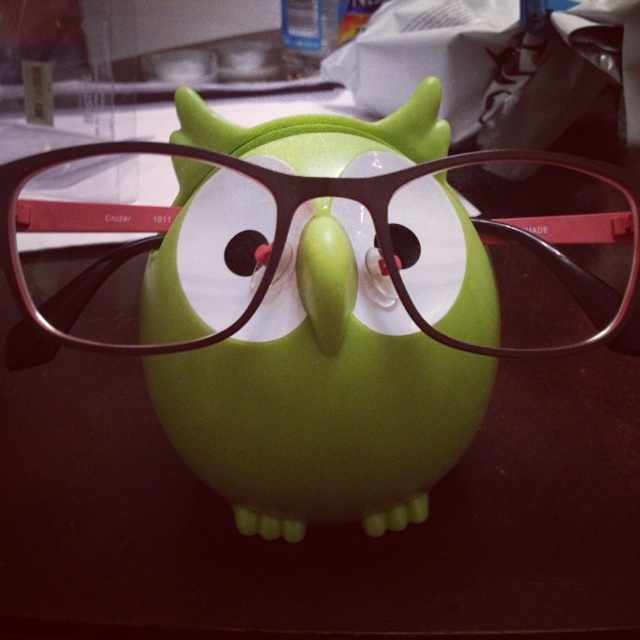
Looking at this image, is matte black glasses at center positioned at the back of matte black eye at center?

No, matte black glasses at center is in front of matte black eye at center.

From the picture: Can you confirm if matte black glasses at center is smaller than matte black eye at center?

No, matte black glasses at center is not smaller than matte black eye at center.

Is point (138, 241) farther from viewer compared to point (232, 269)?

Yes, it is.

You are a GUI agent. You are given a task and a screenshot of the screen. Output one action in this format:
    pyautogui.click(x=<x>, y=<y>)
    Task: Click on the matte black glasses at center
    The height and width of the screenshot is (640, 640).
    Given the screenshot: What is the action you would take?
    coord(288,244)

Can you confirm if green matte/soft toy at center is wider than matte black glasses at center?

In fact, green matte/soft toy at center might be narrower than matte black glasses at center.

Which is more to the left, green matte/soft toy at center or matte black glasses at center?

From the viewer's perspective, green matte/soft toy at center appears more on the left side.

The image size is (640, 640). What do you see at coordinates (323, 394) in the screenshot? I see `green matte/soft toy at center` at bounding box center [323, 394].

I want to click on green matte/soft toy at center, so click(323, 394).

Consider the image. Between green matte/soft toy at center and matte black eye at center, which one appears on the left side from the viewer's perspective?

matte black eye at center is more to the left.

Who is more forward, (385, 342) or (232, 246)?

Point (385, 342) is more forward.

What do you see at coordinates (323, 394) in the screenshot?
I see `green matte/soft toy at center` at bounding box center [323, 394].

Identify the location of green matte/soft toy at center. The image size is (640, 640). (323, 394).